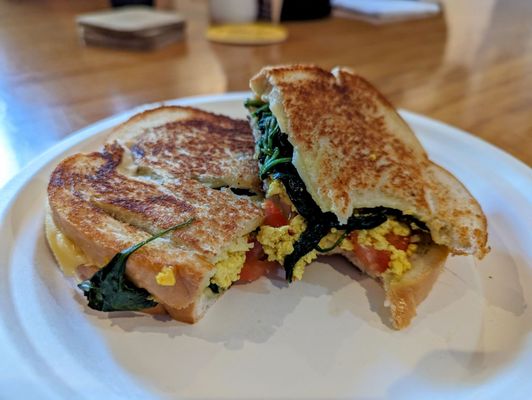
Locate an element on the screen. wood table is located at coordinates (80, 108).